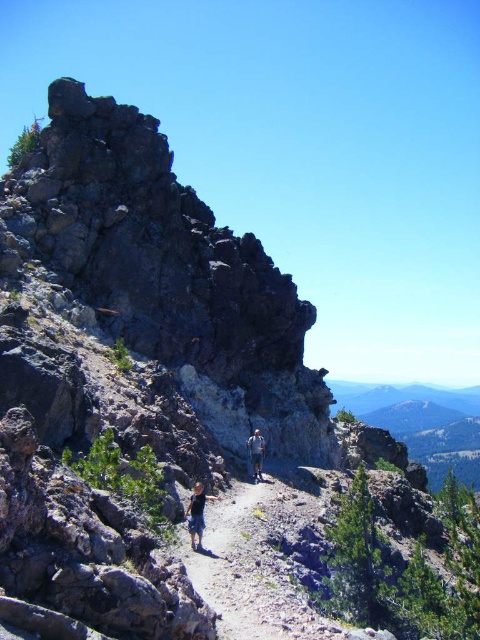
Question: Is dark blue shorts at center thinner than blue denim shorts at center?

Choices:
 (A) yes
 (B) no

Answer: (B)

Question: Which of the following is the closest to the observer?

Choices:
 (A) dark blue shorts at center
 (B) blue denim shorts at center

Answer: (A)

Question: Which point is closer to the camera?

Choices:
 (A) dark blue shorts at center
 (B) blue denim shorts at center

Answer: (A)

Question: Does dark blue shorts at center appear under blue denim shorts at center?

Choices:
 (A) yes
 (B) no

Answer: (B)

Question: Is dark blue shorts at center in front of blue denim shorts at center?

Choices:
 (A) yes
 (B) no

Answer: (A)

Question: Which object appears closest to the camera in this image?

Choices:
 (A) dark blue shorts at center
 (B) blue denim shorts at center

Answer: (A)